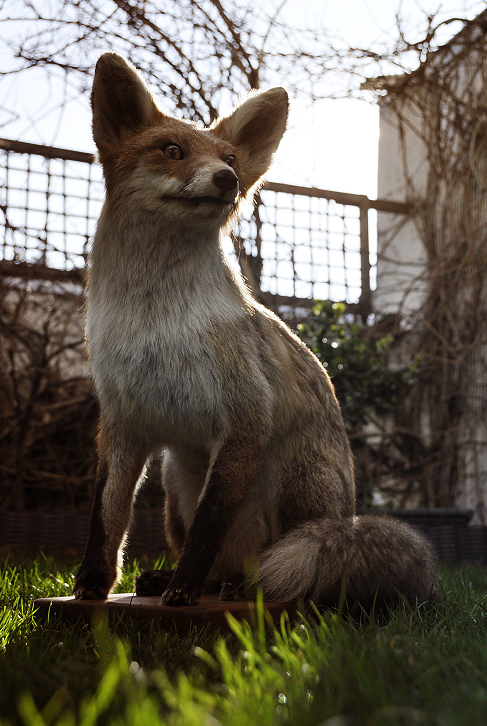
Where is `plant pot`? The height and width of the screenshot is (726, 487). plant pot is located at coordinates (452, 533).